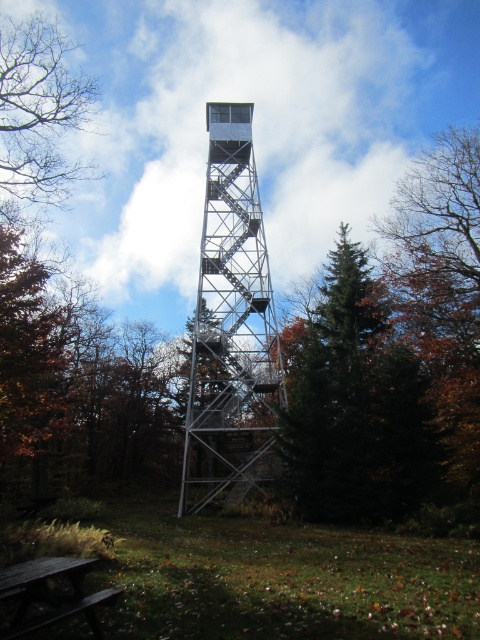
You are standing at the base of the tall, metallic fire observation tower in the autumn forest. Looking up, you notice a specific point marked at coordinates point (37,115). What do you see at that point?

At point (37,115), you see bare branches at the upper left.

You are standing at the base of the metallic silver tower at center and want to look at the bare branches at upper left. Which direction should you turn your head to see them?

You should turn your head to the upper left to see the bare branches at upper left, as they are located in that direction and are positioned behind the metallic silver tower at center.

You are planning to place a new bench next to the dark brown wooden picnic table at lower left. The bench you have is as wide as the metallic silver tower at center. Will it fit next to the picnic table without overlapping?

The metallic silver tower at center is wider than the dark brown wooden picnic table at lower left. Since the bench is as wide as the tower, it will not fit next to the picnic table without overlapping because the bench is wider than the picnic table.